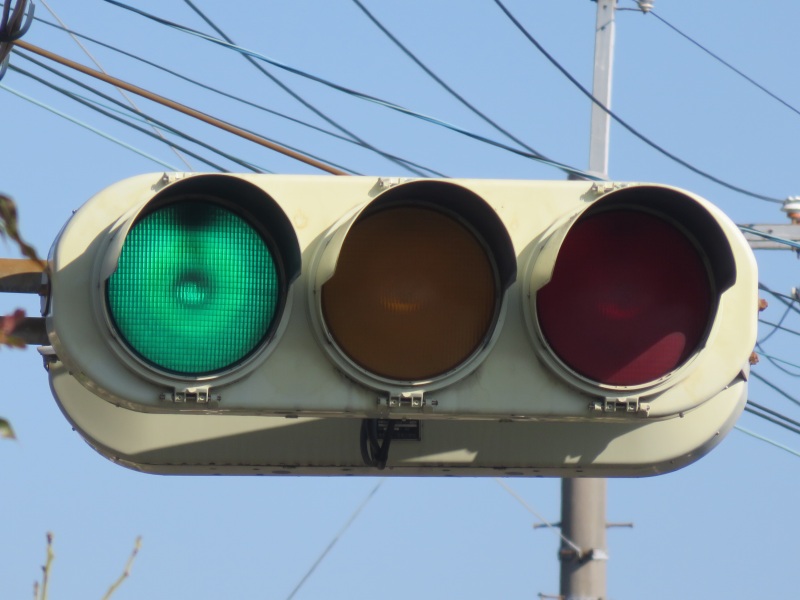
Where is `green light`? The width and height of the screenshot is (800, 600). green light is located at coordinates (198, 319).